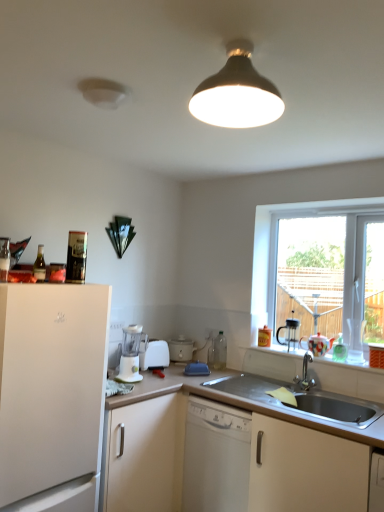
Question: Does white plastic coffee machine at lower center, the 1th coffee machine in the front-to-back sequence, have a smaller size compared to black plastic coffee machine at right, placed as the 2th coffee machine when sorted from front to back?

Choices:
 (A) no
 (B) yes

Answer: (A)

Question: Does white plastic coffee machine at lower center, the 2th coffee machine when ordered from back to front, lie behind black plastic coffee machine at right, placed as the 2th coffee machine when sorted from front to back?

Choices:
 (A) yes
 (B) no

Answer: (B)

Question: Is white plastic coffee machine at lower center, the first coffee machine viewed from the left, beside black plastic coffee machine at right, the 1th coffee machine from the right?

Choices:
 (A) no
 (B) yes

Answer: (A)

Question: From the image's perspective, would you say white plastic coffee machine at lower center, the first coffee machine viewed from the left, is shown under black plastic coffee machine at right, the 2th coffee machine positioned from the left?

Choices:
 (A) no
 (B) yes

Answer: (B)

Question: Considering the relative sizes of white plastic coffee machine at lower center, the 2th coffee machine when ordered from back to front, and black plastic coffee machine at right, the 2th coffee machine positioned from the left, in the image provided, is white plastic coffee machine at lower center, the 2th coffee machine when ordered from back to front, wider than black plastic coffee machine at right, the 2th coffee machine positioned from the left,?

Choices:
 (A) yes
 (B) no

Answer: (A)

Question: From the image's perspective, is white matte dishwasher at center located above or below matte black lampshade at upper center?

Choices:
 (A) above
 (B) below

Answer: (B)

Question: Would you say white matte dishwasher at center is inside or outside matte black lampshade at upper center?

Choices:
 (A) inside
 (B) outside

Answer: (B)

Question: In terms of width, does white matte dishwasher at center look wider or thinner when compared to matte black lampshade at upper center?

Choices:
 (A) thin
 (B) wide

Answer: (B)

Question: Considering the positions of white matte dishwasher at center and matte black lampshade at upper center in the image, is white matte dishwasher at center taller or shorter than matte black lampshade at upper center?

Choices:
 (A) tall
 (B) short

Answer: (A)

Question: From the image's perspective, is stainless steel sink at lower right located above or below black plastic coffee machine at right, the 1th coffee machine from the right?

Choices:
 (A) below
 (B) above

Answer: (A)

Question: Does point (312, 376) appear closer or farther from the camera than point (291, 342)?

Choices:
 (A) farther
 (B) closer

Answer: (B)

Question: In terms of width, does stainless steel sink at lower right look wider or thinner when compared to black plastic coffee machine at right, the 1th coffee machine from the right?

Choices:
 (A) wide
 (B) thin

Answer: (A)

Question: From a real-world perspective, relative to black plastic coffee machine at right, which appears as the first coffee machine when viewed from the back, is stainless steel sink at lower right vertically above or below?

Choices:
 (A) above
 (B) below

Answer: (B)

Question: Is point (292, 322) closer or farther from the camera than point (137, 353)?

Choices:
 (A) closer
 (B) farther

Answer: (B)

Question: Is black plastic coffee machine at right, placed as the 2th coffee machine when sorted from front to back, inside the boundaries of white plastic coffee machine at lower center, which is counted as the second coffee machine, starting from the right, or outside?

Choices:
 (A) outside
 (B) inside

Answer: (A)